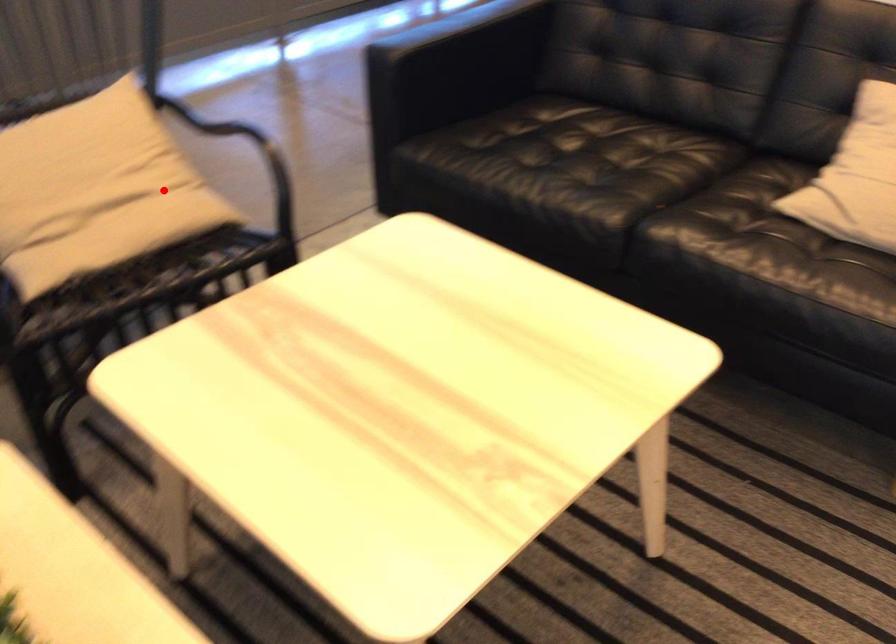
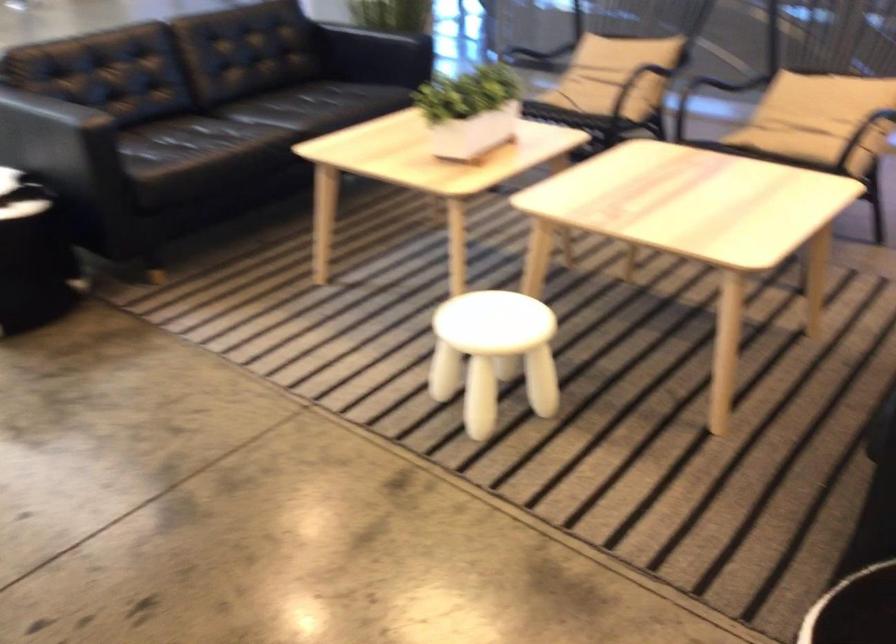
Question: I am providing you with two images of the same scene from different viewpoints. Given a red point in image1, look at the same physical point in image2. Is it:

Choices:
 (A) Closer to the viewpoint
 (B) Farther from the viewpoint

Answer: (B)